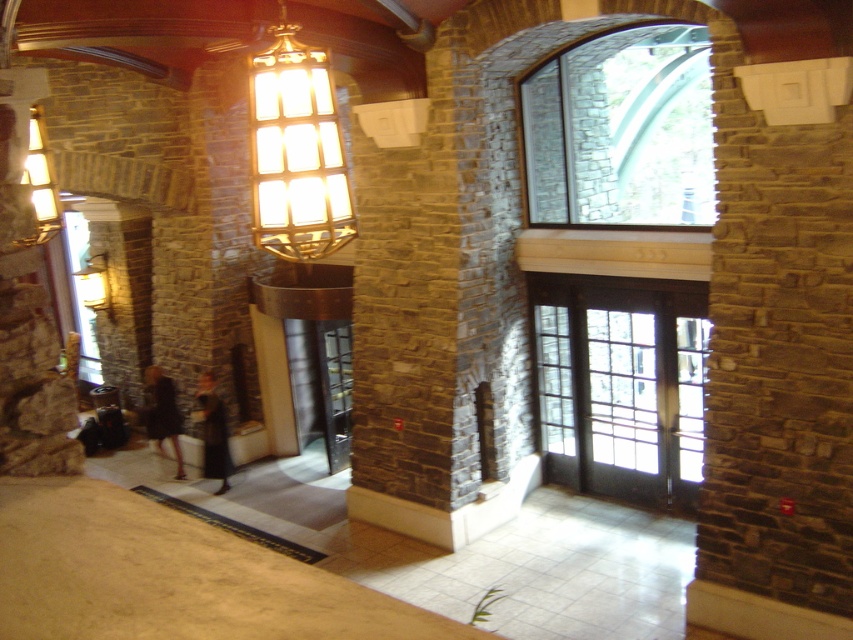
Is dark brown leather jacket at lower left further to the viewer compared to matte gold lamp at left?

No.

What do you see at coordinates (213, 433) in the screenshot? I see `dark brown leather jacket at lower left` at bounding box center [213, 433].

Between point (206, 388) and point (105, 304), which one is positioned in front?

Point (206, 388)

Locate an element on the screen. The image size is (853, 640). dark brown leather jacket at lower left is located at coordinates (213, 433).

Does glass door at center appear on the right side of matte gold light fixture at upper left?

Yes, glass door at center is to the right of matte gold light fixture at upper left.

Is glass door at center above matte gold light fixture at upper left?

No.

Measure the distance between point (x=291, y=387) and camera.

Point (x=291, y=387) is 9.75 meters away from camera.

At what (x,y) coordinates should I click in order to perform the action: click on glass door at center. Please return your answer as a coordinate pair (x, y). Looking at the image, I should click on (321, 385).

Does glass door at center have a larger size compared to matte gold lamp at left?

Yes.

Is glass door at center positioned at the back of matte gold lamp at left?

No.

Find the location of a particular element. This screenshot has width=853, height=640. glass door at center is located at coordinates (321, 385).

Locate an element on the screen. Image resolution: width=853 pixels, height=640 pixels. glass door at center is located at coordinates (321, 385).